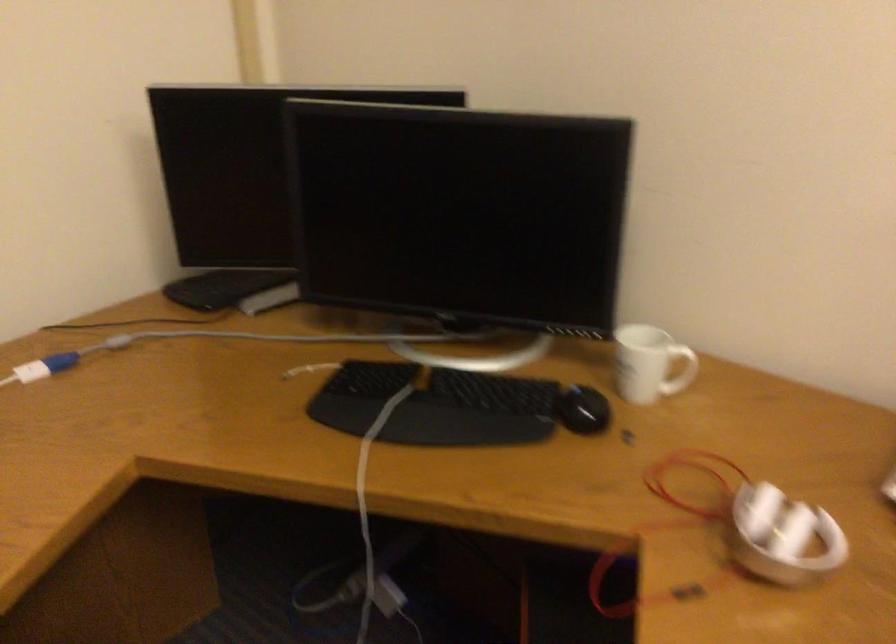
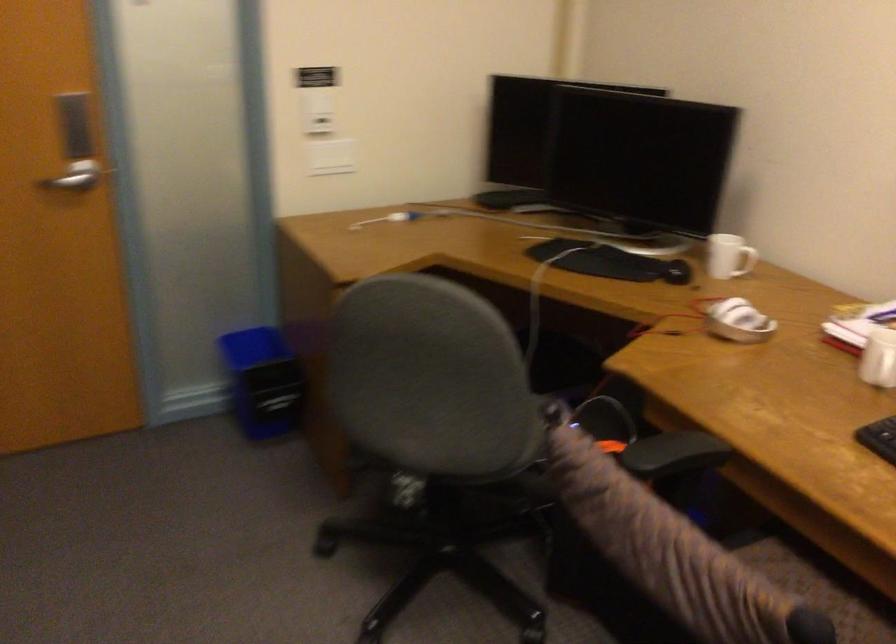
Find the pixel in the second image that matches point (769, 536) in the first image.

(737, 321)